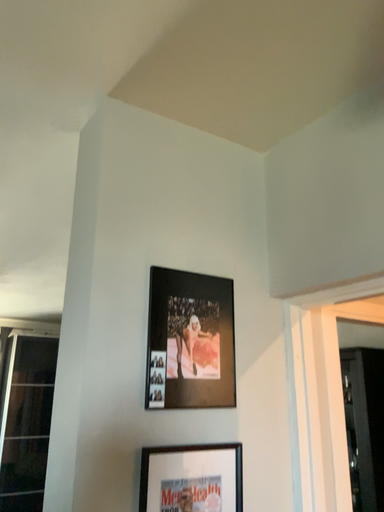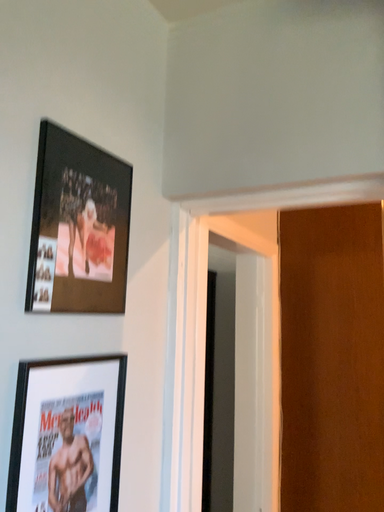
Question: How did the camera likely rotate when shooting the video?

Choices:
 (A) rotated right
 (B) rotated left

Answer: (A)